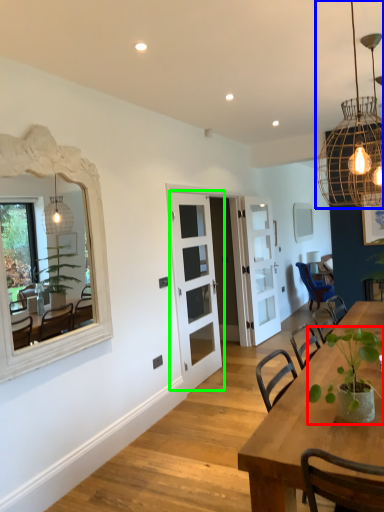
Question: Which object is the closest to the houseplant (highlighted by a red box)? Choose among these: light fixture (highlighted by a blue box) or door (highlighted by a green box).

Choices:
 (A) light fixture
 (B) door

Answer: (A)